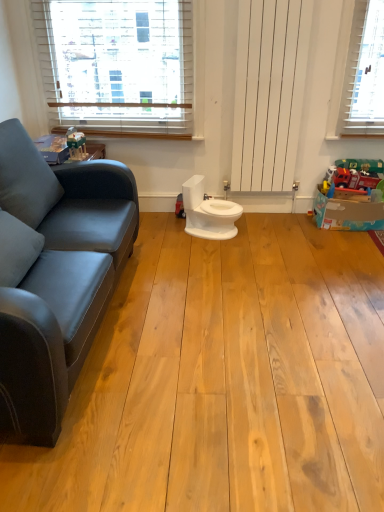
Where is `vacant space situated on the left part of white glossy toilet at center`? The width and height of the screenshot is (384, 512). vacant space situated on the left part of white glossy toilet at center is located at coordinates (155, 229).